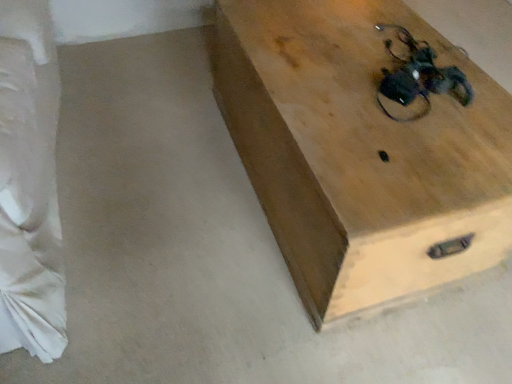
Image resolution: width=512 pixels, height=384 pixels. What do you see at coordinates (360, 153) in the screenshot?
I see `natural wood chest at upper right` at bounding box center [360, 153].

The height and width of the screenshot is (384, 512). What are the coordinates of `natural wood chest at upper right` in the screenshot? It's located at (360, 153).

I want to click on natural wood chest at upper right, so click(360, 153).